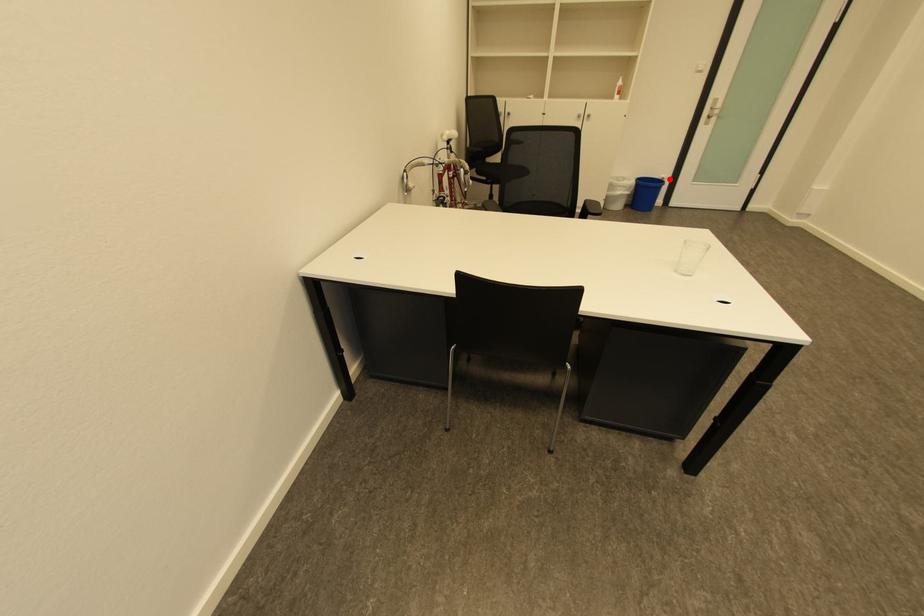
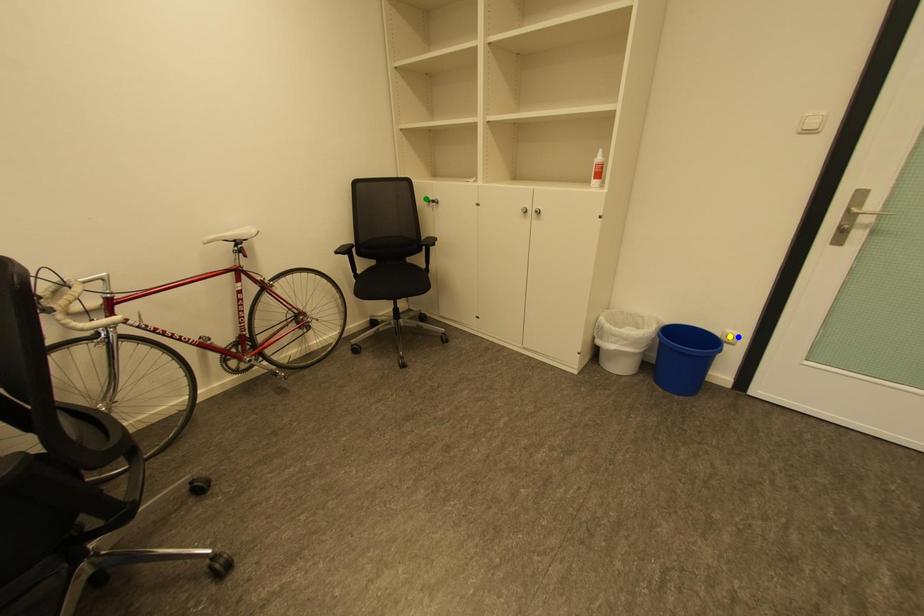
Question: I am providing you with two images of the same scene from different viewpoints. A red point is marked on the first image. You are given multiple points on the second image. Which mark in image 2 goes with the point in image 1?

Choices:
 (A) yellow point
 (B) green point
 (C) blue point

Answer: (C)